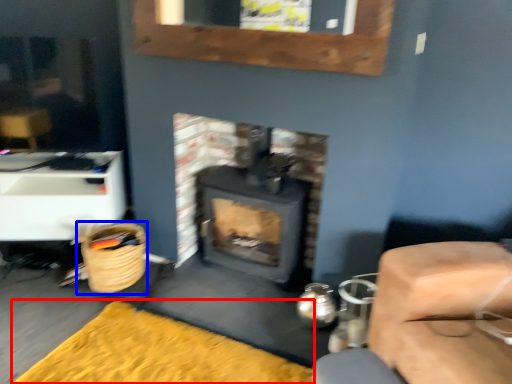
Question: Among these objects, which one is nearest to the camera, doormat (highlighted by a red box) or basket (highlighted by a blue box)?

Choices:
 (A) doormat
 (B) basket

Answer: (A)